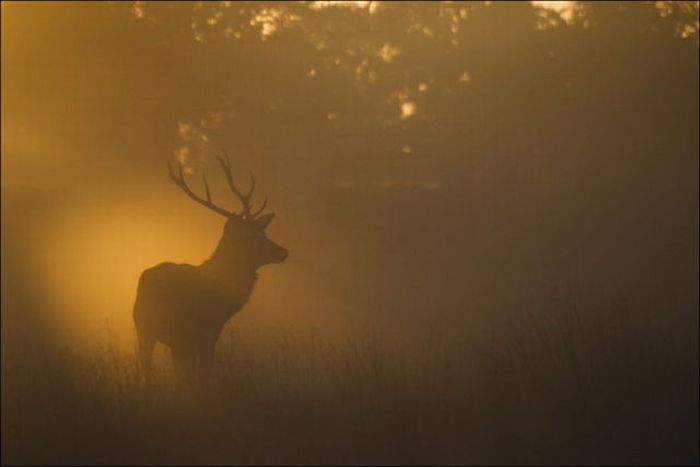
At what (x,y) coordinates should I click in order to perform the action: click on light. Please return your answer as a coordinate pair (x, y). Looking at the image, I should click on (558, 17).